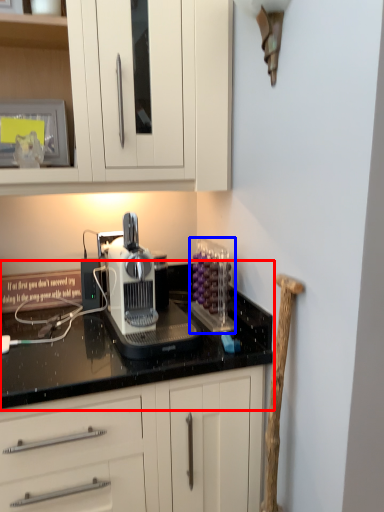
Question: Which object is further to the camera taking this photo, countertop (highlighted by a red box) or kitchen appliance (highlighted by a blue box)?

Choices:
 (A) countertop
 (B) kitchen appliance

Answer: (B)